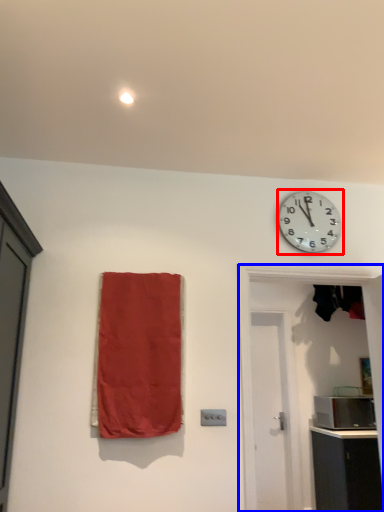
Question: Which object appears farthest to the camera in this image, wall clock (highlighted by a red box) or door (highlighted by a blue box)?

Choices:
 (A) wall clock
 (B) door

Answer: (A)